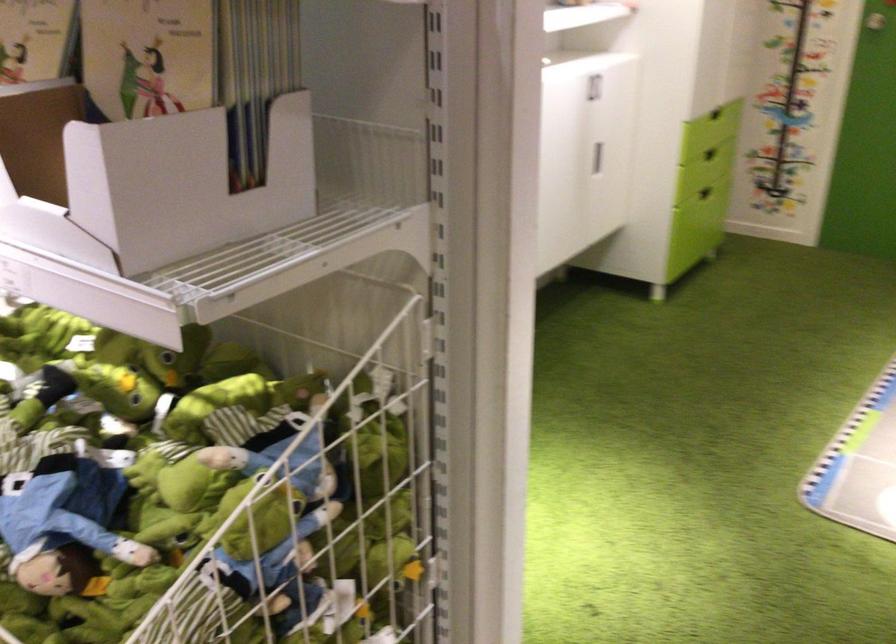
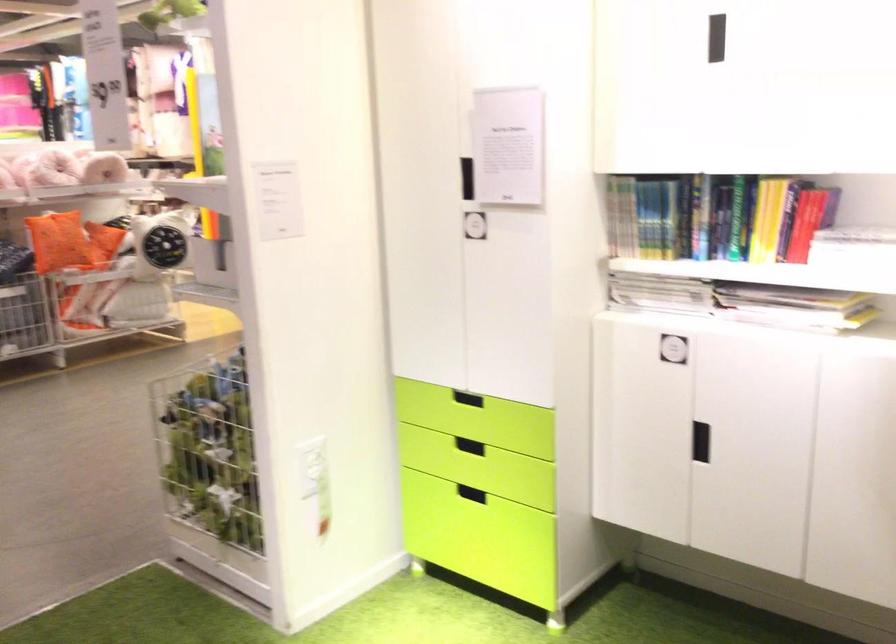
Question: I am providing you with two images of the same scene from different viewpoints. Please identify which objects are invisible in image2.

Choices:
 (A) stuffed frog toy
 (B) book
 (C) orange square pillow
 (D) blue q-tips box

Answer: (A)